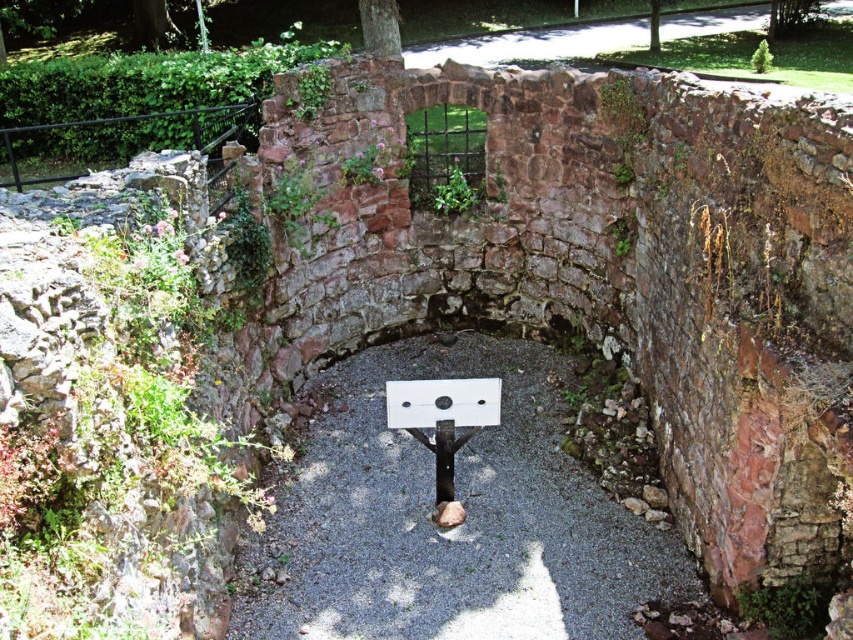
Question: Is gray gravel at center further to the viewer compared to white matte signpost at center?

Choices:
 (A) no
 (B) yes

Answer: (A)

Question: Based on their relative distances, which object is farther from the white plastic sign at center?

Choices:
 (A) white matte signpost at center
 (B) gray gravel at center

Answer: (B)

Question: Among these objects, which one is nearest to the camera?

Choices:
 (A) white plastic sign at center
 (B) gray gravel at center
 (C) white matte signpost at center

Answer: (B)

Question: Which of the following is the closest to the observer?

Choices:
 (A) white plastic sign at center
 (B) white matte signpost at center

Answer: (A)

Question: From the image, what is the correct spatial relationship of white matte signpost at center in relation to white plastic sign at center?

Choices:
 (A) above
 (B) below

Answer: (B)

Question: Is gray gravel at center smaller than white plastic sign at center?

Choices:
 (A) no
 (B) yes

Answer: (A)